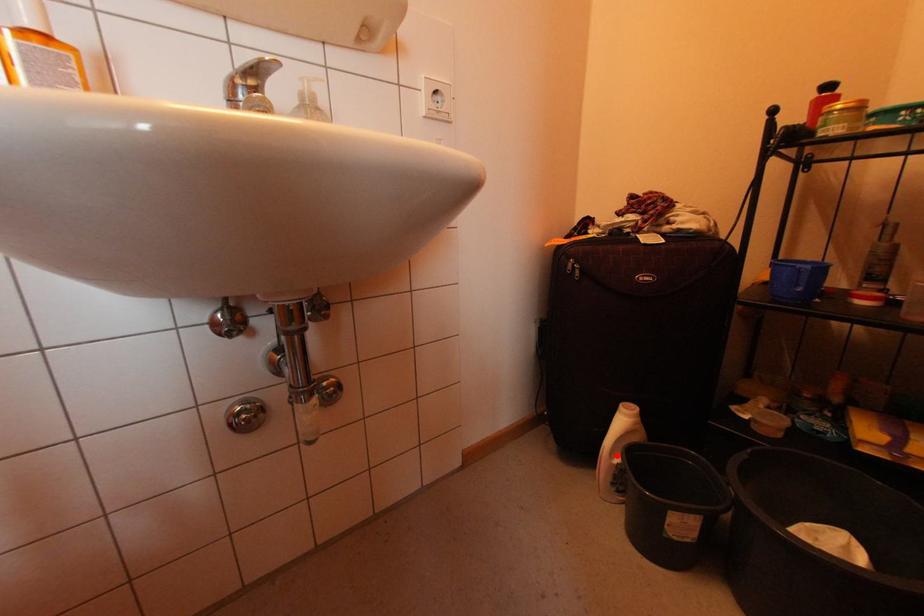
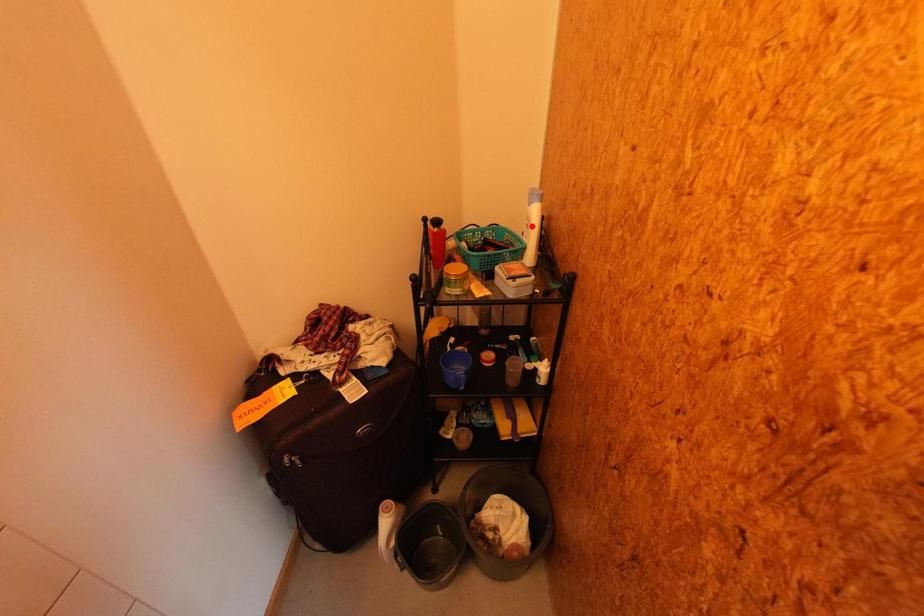
I am providing you with two images of the same scene from different viewpoints. A red point is marked on the first image and another point is marked on the second image. Is the marked point in image1 the same physical position as the marked point in image2?

No